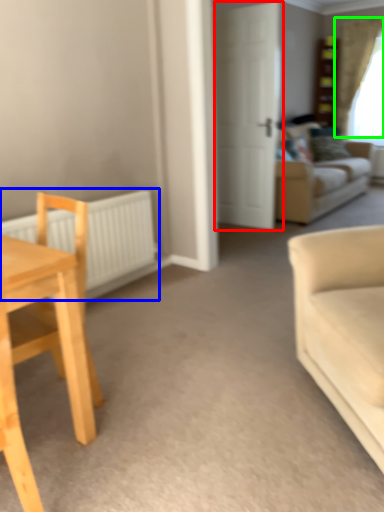
Question: Considering the real-world distances, which object is closest to door (highlighted by a red box)? radiator (highlighted by a blue box) or curtain (highlighted by a green box).

Choices:
 (A) radiator
 (B) curtain

Answer: (A)